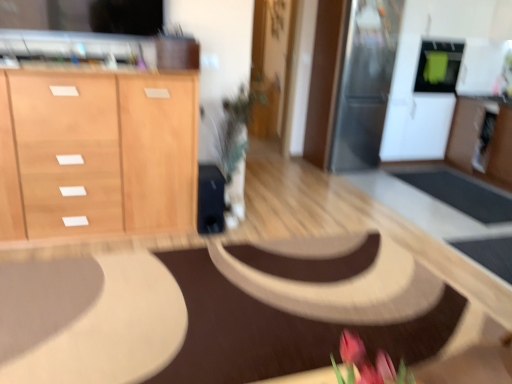
Question: From the image's perspective, is light wood cabinet at left beneath green matte microwave at upper right, the 2th appliance positioned from the left?

Choices:
 (A) no
 (B) yes

Answer: (B)

Question: Is light wood cabinet at left shorter than green matte microwave at upper right, arranged as the 1th appliance when viewed from the right?

Choices:
 (A) yes
 (B) no

Answer: (B)

Question: From a real-world perspective, is light wood cabinet at left physically below green matte microwave at upper right, arranged as the 1th appliance when viewed from the right?

Choices:
 (A) yes
 (B) no

Answer: (A)

Question: Is light wood cabinet at left to the left of green matte microwave at upper right, arranged as the 1th appliance when viewed from the right, from the viewer's perspective?

Choices:
 (A) no
 (B) yes

Answer: (B)

Question: Is light wood cabinet at left in front of green matte microwave at upper right, arranged as the 1th appliance when viewed from the right?

Choices:
 (A) yes
 (B) no

Answer: (A)

Question: Visually, is green matte microwave at upper right, arranged as the 1th appliance when viewed from the right, positioned to the left or to the right of sleek stainless steel refrigerator at upper right, the 1th appliance viewed from the left?

Choices:
 (A) left
 (B) right

Answer: (B)

Question: From a real-world perspective, is green matte microwave at upper right, arranged as the 1th appliance when viewed from the right, above or below sleek stainless steel refrigerator at upper right, the 1th appliance viewed from the left?

Choices:
 (A) below
 (B) above

Answer: (B)

Question: Is green matte microwave at upper right, the 2th appliance positioned from the left, inside the boundaries of sleek stainless steel refrigerator at upper right, the 1th appliance viewed from the left, or outside?

Choices:
 (A) outside
 (B) inside

Answer: (A)

Question: Is green matte microwave at upper right, the 2th appliance positioned from the left, bigger or smaller than sleek stainless steel refrigerator at upper right, which is the second appliance in right-to-left order?

Choices:
 (A) small
 (B) big

Answer: (A)

Question: Based on their positions, is sleek stainless steel refrigerator at upper right, the 1th appliance viewed from the left, located to the left or right of light wood cabinet at left?

Choices:
 (A) right
 (B) left

Answer: (A)

Question: Looking at the image, does sleek stainless steel refrigerator at upper right, the 1th appliance viewed from the left, seem bigger or smaller compared to light wood cabinet at left?

Choices:
 (A) small
 (B) big

Answer: (A)

Question: Is point (369, 160) positioned closer to the camera than point (142, 89)?

Choices:
 (A) closer
 (B) farther

Answer: (B)

Question: In terms of width, does sleek stainless steel refrigerator at upper right, which is the second appliance in right-to-left order, look wider or thinner when compared to light wood cabinet at left?

Choices:
 (A) wide
 (B) thin

Answer: (B)

Question: Is light wood cabinet at left bigger or smaller than brown fabric mat at center?

Choices:
 (A) big
 (B) small

Answer: (A)

Question: From a real-world perspective, is light wood cabinet at left above or below brown fabric mat at center?

Choices:
 (A) below
 (B) above

Answer: (B)